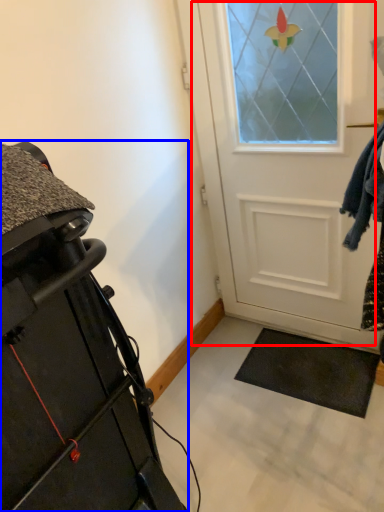
Question: Which object is closer to the camera taking this photo, door (highlighted by a red box) or furniture (highlighted by a blue box)?

Choices:
 (A) door
 (B) furniture

Answer: (B)